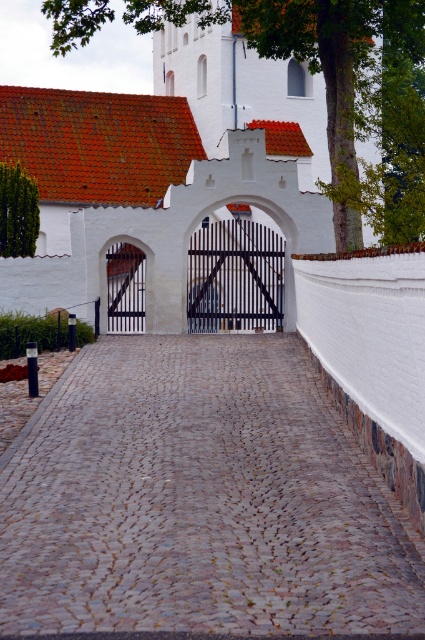
You are standing at the base of the green leafy tree at upper center and want to throw a ball to a friend who is standing exactly 50 feet away from you. Can you reach your friend with one throw?

The distance between you and your friend is exactly 50 feet, and the green leafy tree at upper center and viewer are 50.02 feet apart. Since 50.02 feet is slightly more than 50 feet, you can just barely reach your friend with one throw.

You are standing at the entrance of the white church with red tiled roofs and see a point marked at coordinates (x=314, y=61). According to the scene description, which object is this point located on?

The point at coordinates 0.099, 0.739 is located on the green leafy tree at upper center.